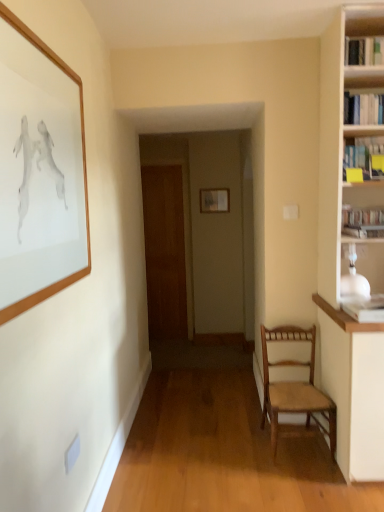
In order to click on free space above brown wooden door at center (from a real-world perspective) in this screenshot , I will do `click(161, 161)`.